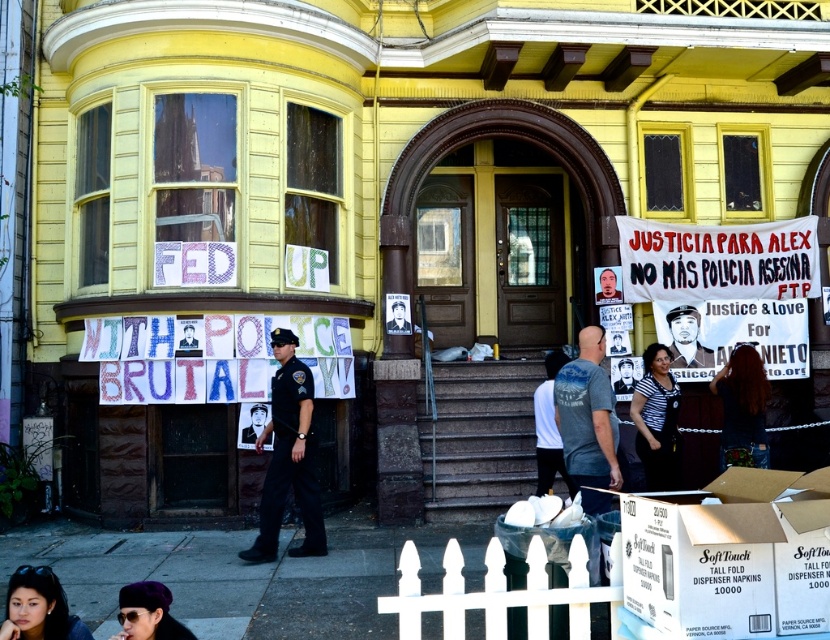
Is gray cotton t-shirt at center closer to the viewer compared to matte black photo at center?

That is True.

Does gray cotton t-shirt at center appear on the right side of matte black photo at center?

Yes, gray cotton t-shirt at center is to the right of matte black photo at center.

Does point (592, 353) lie in front of point (189, 333)?

That is True.

Locate an element on the screen. This screenshot has width=830, height=640. gray cotton t-shirt at center is located at coordinates (588, 420).

Can you confirm if black matte poster at center is positioned above matte black photo at center?

Yes.

Find the location of `black matte poster at center`. black matte poster at center is located at coordinates pyautogui.click(x=398, y=314).

Which of these two, purple fabric headscarf at lower left or smooth cardboard poster at center, stands taller?

Standing taller between the two is smooth cardboard poster at center.

At what (x,y) coordinates should I click in order to perform the action: click on purple fabric headscarf at lower left. Please return your answer as a coordinate pair (x, y). The height and width of the screenshot is (640, 830). Looking at the image, I should click on (147, 612).

You are a GUI agent. You are given a task and a screenshot of the screen. Output one action in this format:
    pyautogui.click(x=<x>, y=<y>)
    Task: Click on the purple fabric headscarf at lower left
    The height and width of the screenshot is (640, 830).
    Given the screenshot: What is the action you would take?
    pyautogui.click(x=147, y=612)

The width and height of the screenshot is (830, 640). Find the location of `purple fabric headscarf at lower left`. purple fabric headscarf at lower left is located at coordinates (147, 612).